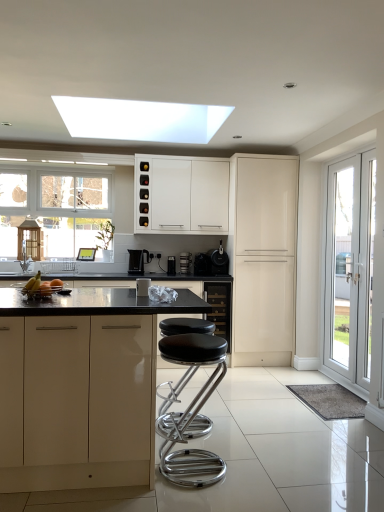
Question: From the image's perspective, is satin black toaster at center, the third appliance viewed from the right, below polished chrome stool at center?

Choices:
 (A) yes
 (B) no

Answer: (B)

Question: Is satin black toaster at center, which is the 5th appliance in front-to-back order, in contact with polished chrome stool at center?

Choices:
 (A) no
 (B) yes

Answer: (A)

Question: Is satin black toaster at center, the third appliance viewed from the right, taller than polished chrome stool at center?

Choices:
 (A) yes
 (B) no

Answer: (B)

Question: Is satin black toaster at center, which is the 5th appliance in front-to-back order, smaller than polished chrome stool at center?

Choices:
 (A) no
 (B) yes

Answer: (B)

Question: From the image's perspective, would you say satin black toaster at center, which is the 5th appliance in front-to-back order, is positioned over polished chrome stool at center?

Choices:
 (A) no
 (B) yes

Answer: (B)

Question: Do you think black matte wine cooler at center, marked as the third cabinetry in a back-to-front arrangement, is within wooden door at left, the 2th door viewed from the right, or outside of it?

Choices:
 (A) inside
 (B) outside

Answer: (B)

Question: Based on their positions, is black matte wine cooler at center, positioned as the second cabinetry in front-to-back order, located to the left or right of wooden door at left, which is the 1th door from left to right?

Choices:
 (A) right
 (B) left

Answer: (A)

Question: In the image, is black matte wine cooler at center, marked as the third cabinetry in a back-to-front arrangement, positioned in front of or behind wooden door at left, the 2th door viewed from the right?

Choices:
 (A) behind
 (B) front

Answer: (B)

Question: Considering the positions of black matte wine cooler at center, positioned as the second cabinetry in front-to-back order, and wooden door at left, which is the 1th door from left to right, in the image, is black matte wine cooler at center, positioned as the second cabinetry in front-to-back order, wider or thinner than wooden door at left, which is the 1th door from left to right,?

Choices:
 (A) thin
 (B) wide

Answer: (B)

Question: Does point (26, 289) appear closer or farther from the camera than point (175, 258)?

Choices:
 (A) farther
 (B) closer

Answer: (B)

Question: In terms of width, does yellow matte bananas at center look wider or thinner when compared to black plastic coffee maker at center, which is counted as the second appliance, starting from the back?

Choices:
 (A) wide
 (B) thin

Answer: (A)

Question: Is yellow matte bananas at center in front of or behind black plastic coffee maker at center, which is counted as the second appliance, starting from the back, in the image?

Choices:
 (A) front
 (B) behind

Answer: (A)

Question: Based on their positions, is yellow matte bananas at center located to the left or right of black plastic coffee maker at center, the second appliance when ordered from left to right?

Choices:
 (A) left
 (B) right

Answer: (A)

Question: Considering the relative positions of black plastic kettle at center and matte cream cabinet at center-right, which is counted as the second cabinetry, starting from the back, in the image provided, is black plastic kettle at center to the left or to the right of matte cream cabinet at center-right, which is counted as the second cabinetry, starting from the back,?

Choices:
 (A) right
 (B) left

Answer: (B)

Question: Is black plastic kettle at center inside or outside of matte cream cabinet at center-right, which is counted as the second cabinetry, starting from the back?

Choices:
 (A) outside
 (B) inside

Answer: (A)